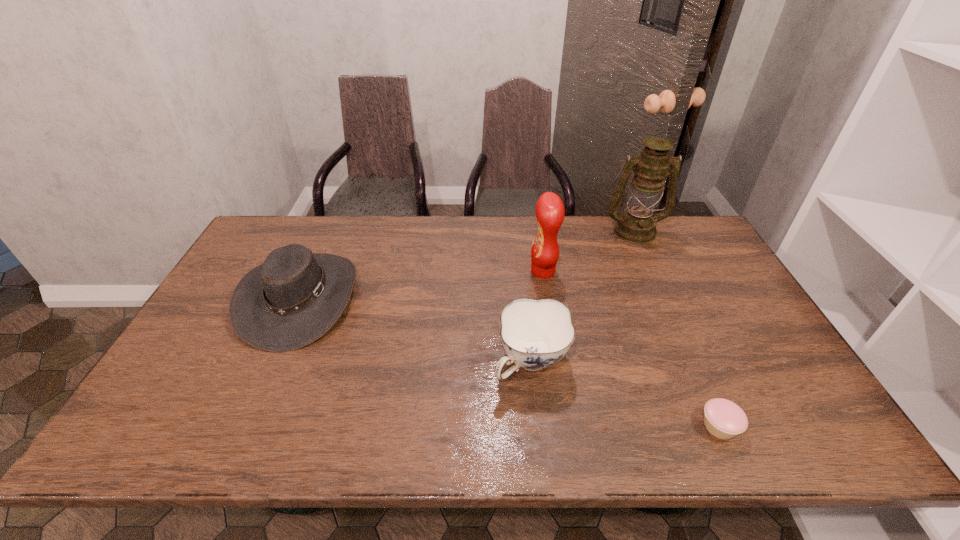
Where is `object located at the far right corner`? object located at the far right corner is located at coordinates (637, 225).

This screenshot has width=960, height=540. What are the coordinates of `free spot at the far edge of the desktop` in the screenshot? It's located at (631, 246).

Find the location of a particular element. This screenshot has width=960, height=540. vacant space at the near edge of the desktop is located at coordinates (693, 424).

The image size is (960, 540). In the image, there is a desktop. Find the location of `free region at the right edge`. free region at the right edge is located at coordinates (756, 413).

Identify the location of free space at the far left corner of the desktop. (272, 245).

This screenshot has height=540, width=960. Find the location of `vacant point located between the nearest object and the fourth shortest object`. vacant point located between the nearest object and the fourth shortest object is located at coordinates pos(631,349).

I want to click on unoccupied area between the nearest object and the chinaware, so click(625, 394).

I want to click on free spot between the farthest object and the chinaware, so click(583, 296).

Locate an element on the screen. vacant area between the tallest object and the chinaware is located at coordinates (583, 296).

Where is `free space that is in between the oil lamp and the cupcake`? Image resolution: width=960 pixels, height=540 pixels. free space that is in between the oil lamp and the cupcake is located at coordinates (677, 328).